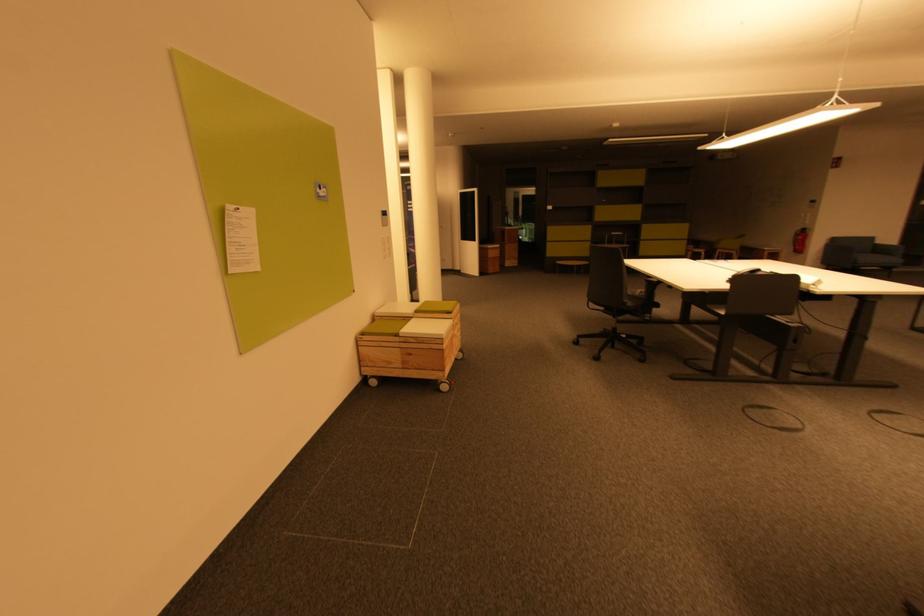
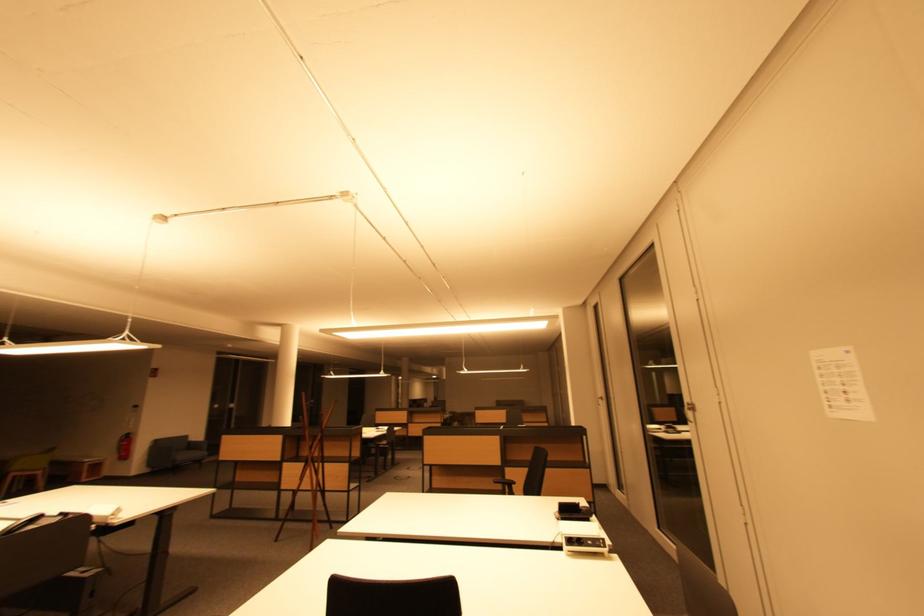
Locate, in the second image, the point that corresponds to point (871, 262) in the first image.

(188, 458)